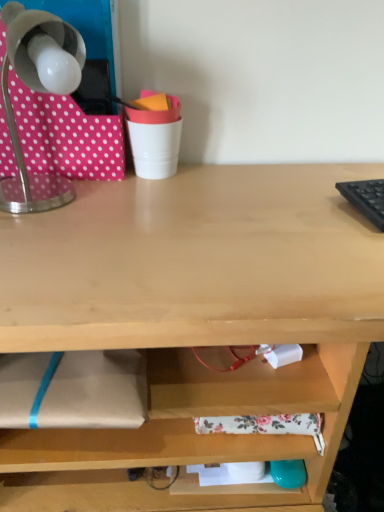
What do you see at coordinates (66, 136) in the screenshot?
I see `pink polka dot fabric at upper left` at bounding box center [66, 136].

Where is `metallic gray lamp at upper left`? The height and width of the screenshot is (512, 384). metallic gray lamp at upper left is located at coordinates (38, 91).

Measure the distance between point (160, 138) and camera.

32.52 inches.

At what (x,y) coordinates should I click in order to perform the action: click on pink polka dot fabric at upper left. Please return your answer as a coordinate pair (x, y). Looking at the image, I should click on (66, 136).

From their relative heights in the image, would you say metallic gray lamp at upper left is taller or shorter than pink polka dot fabric at upper left?

metallic gray lamp at upper left is shorter than pink polka dot fabric at upper left.

Which of these two, metallic gray lamp at upper left or pink polka dot fabric at upper left, is bigger?

With larger size is metallic gray lamp at upper left.

Could you tell me if metallic gray lamp at upper left is turned towards pink polka dot fabric at upper left?

Yes, metallic gray lamp at upper left is turned towards pink polka dot fabric at upper left.

Can you confirm if white plastic cup at upper center is wider than pink polka dot fabric at upper left?

No.

Looking at this image, is pink polka dot fabric at upper left completely or partially inside white plastic cup at upper center?

No, white plastic cup at upper center does not contain pink polka dot fabric at upper left.

From a real-world perspective, is white plastic cup at upper center positioned above or below pink polka dot fabric at upper left?

Clearly, from a real-world perspective, white plastic cup at upper center is below pink polka dot fabric at upper left.

Between white plastic cup at upper center and pink polka dot fabric at upper left, which one appears on the right side from the viewer's perspective?

Positioned to the right is white plastic cup at upper center.

Which object is positioned more to the left, metallic gray lamp at upper left or white plastic cup at upper center?

A: From the viewer's perspective, metallic gray lamp at upper left appears more on the left side.

Does metallic gray lamp at upper left have a greater width compared to white plastic cup at upper center?

Yes, metallic gray lamp at upper left is wider than white plastic cup at upper center.

Does point (71, 197) come closer to viewer compared to point (148, 134)?

Yes, point (71, 197) is in front of point (148, 134).

From the picture: Considering the relative sizes of metallic gray lamp at upper left and white plastic cup at upper center in the image provided, is metallic gray lamp at upper left smaller than white plastic cup at upper center?

Incorrect, metallic gray lamp at upper left is not smaller in size than white plastic cup at upper center.

Based on the photo, is pink polka dot fabric at upper left looking in the opposite direction of white plastic cup at upper center?

No, white plastic cup at upper center is not at the back of pink polka dot fabric at upper left.

Is point (49, 112) closer or farther from the camera than point (160, 132)?

Point (49, 112) is positioned closer to the camera compared to point (160, 132).

Would you say pink polka dot fabric at upper left is to the left or to the right of white plastic cup at upper center in the picture?

pink polka dot fabric at upper left is to the left of white plastic cup at upper center.

How distant is pink polka dot fabric at upper left from white plastic cup at upper center?

The distance of pink polka dot fabric at upper left from white plastic cup at upper center is 4.42 inches.

Considering the sizes of white plastic cup at upper center and metallic gray lamp at upper left in the image, is white plastic cup at upper center taller or shorter than metallic gray lamp at upper left?

Clearly, white plastic cup at upper center is shorter compared to metallic gray lamp at upper left.

Considering the points (173, 128) and (3, 197), which point is in front, point (173, 128) or point (3, 197)?

Point (3, 197)

Considering the relative sizes of white plastic cup at upper center and metallic gray lamp at upper left in the image provided, is white plastic cup at upper center wider than metallic gray lamp at upper left?

Incorrect, the width of white plastic cup at upper center does not surpass that of metallic gray lamp at upper left.

Does pink polka dot fabric at upper left turn towards metallic gray lamp at upper left?

Yes, pink polka dot fabric at upper left is turned towards metallic gray lamp at upper left.

Is pink polka dot fabric at upper left positioned before metallic gray lamp at upper left?

No, pink polka dot fabric at upper left is further to the viewer.

Does pink polka dot fabric at upper left touch metallic gray lamp at upper left?

Yes, pink polka dot fabric at upper left is in contact with metallic gray lamp at upper left.

The image size is (384, 512). Find the location of `fabric above the metallic gray lamp at upper left (from the image's perspective)`. fabric above the metallic gray lamp at upper left (from the image's perspective) is located at coordinates (66, 136).

I want to click on fabric lying in front of the white plastic cup at upper center, so click(66, 136).

Estimate the real-world distances between objects in this image. Which object is closer to pink polka dot fabric at upper left, white plastic cup at upper center or metallic gray lamp at upper left?

metallic gray lamp at upper left is positioned closer to the anchor pink polka dot fabric at upper left.

Considering their positions, is metallic gray lamp at upper left positioned further to white plastic cup at upper center than pink polka dot fabric at upper left?

Among the two, metallic gray lamp at upper left is located further to white plastic cup at upper center.

Looking at the image, which one is located further to metallic gray lamp at upper left, pink polka dot fabric at upper left or white plastic cup at upper center?

white plastic cup at upper center.

Based on their spatial positions, is white plastic cup at upper center or pink polka dot fabric at upper left closer to metallic gray lamp at upper left?

pink polka dot fabric at upper left is positioned closer to the anchor metallic gray lamp at upper left.

Looking at the image, which one is located further to pink polka dot fabric at upper left, metallic gray lamp at upper left or white plastic cup at upper center?

Among the two, white plastic cup at upper center is located further to pink polka dot fabric at upper left.

Considering their positions, is pink polka dot fabric at upper left positioned closer to white plastic cup at upper center than metallic gray lamp at upper left?

pink polka dot fabric at upper left is closer to white plastic cup at upper center.

This screenshot has width=384, height=512. Find the location of `fabric positioned between metallic gray lamp at upper left and white plastic cup at upper center from near to far`. fabric positioned between metallic gray lamp at upper left and white plastic cup at upper center from near to far is located at coordinates (66, 136).